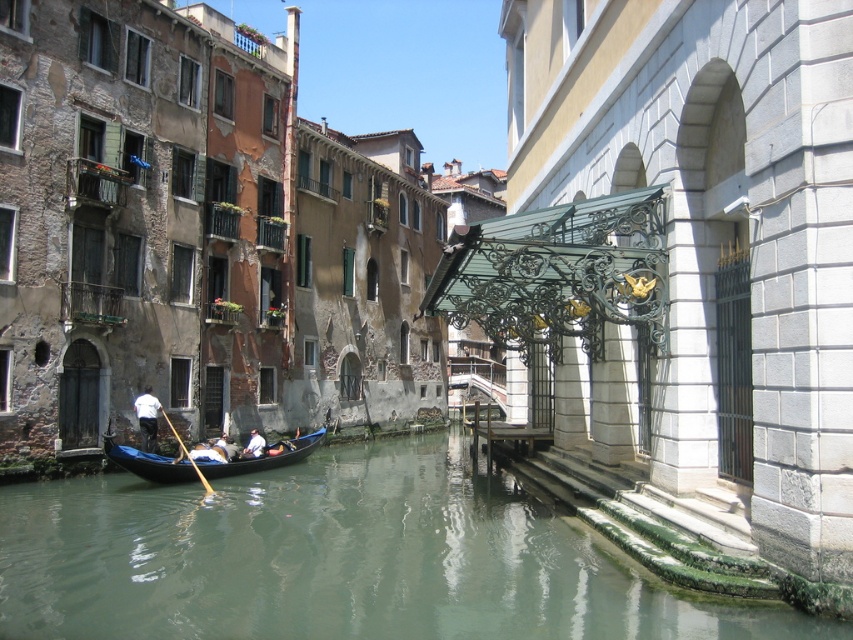
Who is positioned more to the left, black polished wood gondola at center or white matte shirt at center?

From the viewer's perspective, white matte shirt at center appears more on the left side.

Is the position of black polished wood gondola at center less distant than that of white matte shirt at center?

Yes, it is.

Find the location of a particular element. black polished wood gondola at center is located at coordinates (264, 456).

The image size is (853, 640). I want to click on black polished wood gondola at center, so click(264, 456).

Which is below, white matte shirt at center or white fabric shirt at lower center?

white fabric shirt at lower center

Is point (154, 397) farther from viewer compared to point (254, 429)?

No.

Where is `white matte shirt at center`? The image size is (853, 640). white matte shirt at center is located at coordinates (148, 417).

Between point (544, 634) and point (257, 452), which one is positioned in front?

Point (544, 634) is in front.

Is greenish water at lower center positioned before white fabric shirt at lower center?

Yes, greenish water at lower center is in front of white fabric shirt at lower center.

Which is behind, point (432, 461) or point (259, 440)?

Positioned behind is point (432, 461).

This screenshot has width=853, height=640. I want to click on greenish water at lower center, so click(x=340, y=557).